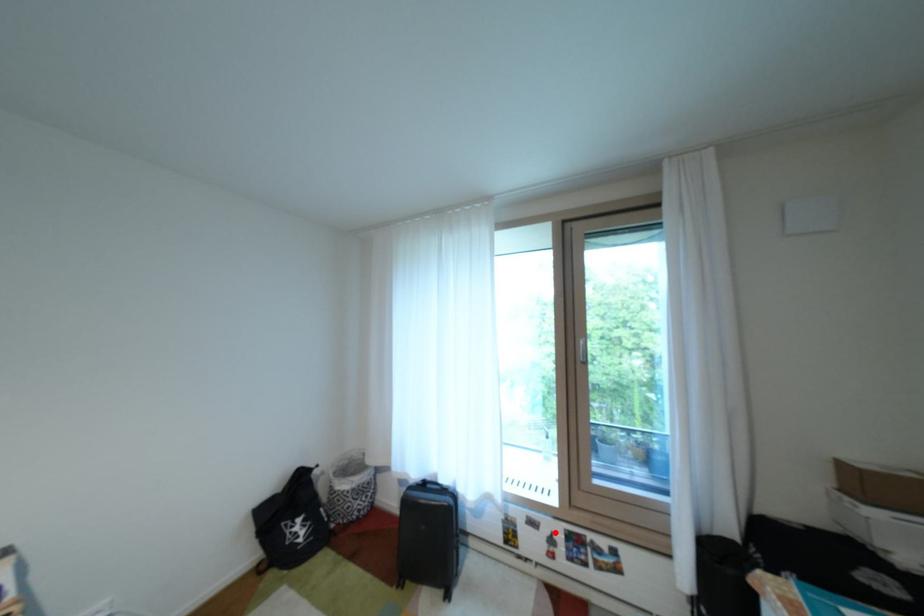
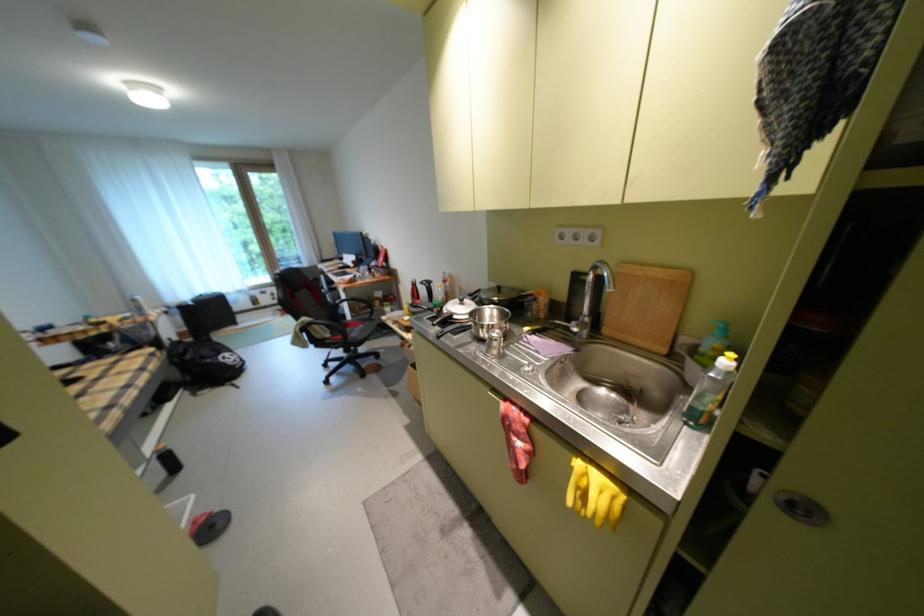
Question: I am providing you with two images of the same scene from different viewpoints. Given a red point in image1, look at the same physical point in image2. Is it:

Choices:
 (A) Closer to the viewpoint
 (B) Farther from the viewpoint

Answer: (B)